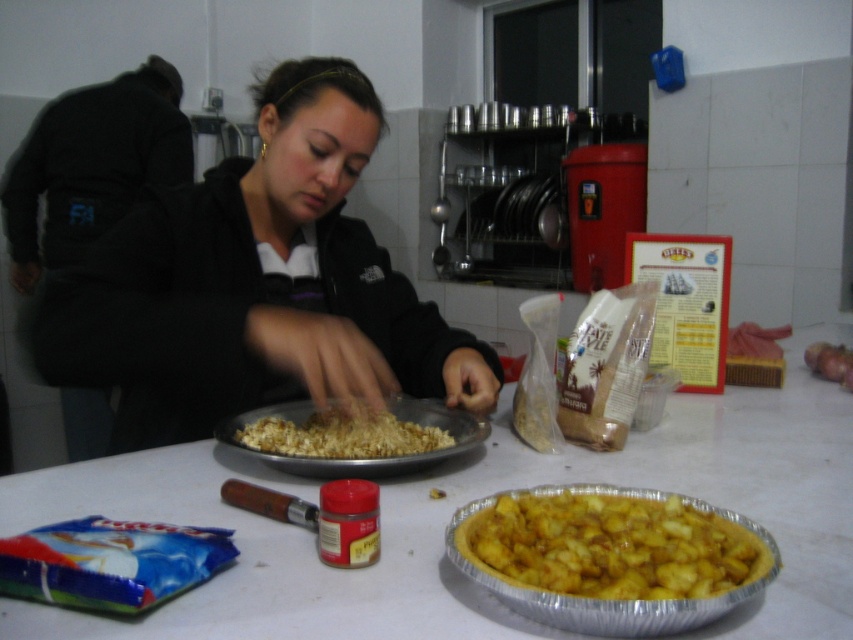
You are a chef in a busy kitchen. You need to quickly grab an ingredient from the golden crumbly pie at center and the golden crunchy popcorn at center. Which one is easier to reach?

The golden crumbly pie at center is easier to reach because it is located below the golden crunchy popcorn at center, making it closer to the chef.

You are standing in the kitchen and want to reach the black matte jacket at center. Is the white matte table at center blocking your path to it?

The white matte table at center is closer to the viewer than black matte jacket at center, so the table is between you and the jacket, blocking your path.

You are a chef standing behind the white matte table at center. You want to place a new ingredient on the table. However, there is an obstacle blocking your path to the golden crunchy popcorn at center. Can you reach the popcorn without moving the table?

The white matte table at center is in front of the golden crunchy popcorn at center, meaning the table is blocking access to the popcorn. To reach the popcorn, you would need to move around the table or remove the table first.